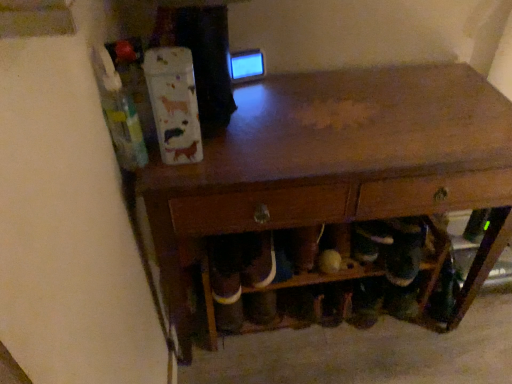
Question: From a real-world perspective, is wooden table at center over wooden shoe rack at lower center?

Choices:
 (A) yes
 (B) no

Answer: (A)

Question: From the image's perspective, would you say wooden table at center is shown under wooden shoe rack at lower center?

Choices:
 (A) yes
 (B) no

Answer: (B)

Question: Is wooden table at center taller than wooden shoe rack at lower center?

Choices:
 (A) yes
 (B) no

Answer: (A)

Question: Is wooden table at center turned away from wooden shoe rack at lower center?

Choices:
 (A) no
 (B) yes

Answer: (B)

Question: Does wooden table at center have a smaller size compared to wooden shoe rack at lower center?

Choices:
 (A) yes
 (B) no

Answer: (B)

Question: Can you confirm if wooden table at center is thinner than wooden shoe rack at lower center?

Choices:
 (A) yes
 (B) no

Answer: (B)

Question: Is wooden shoe rack at lower center taller than wooden table at center?

Choices:
 (A) yes
 (B) no

Answer: (B)

Question: Is the surface of wooden shoe rack at lower center in direct contact with wooden table at center?

Choices:
 (A) yes
 (B) no

Answer: (B)

Question: Can you confirm if wooden shoe rack at lower center is thinner than wooden table at center?

Choices:
 (A) no
 (B) yes

Answer: (B)

Question: Does wooden shoe rack at lower center have a smaller size compared to wooden table at center?

Choices:
 (A) no
 (B) yes

Answer: (B)

Question: Can you confirm if wooden shoe rack at lower center is positioned to the left of wooden table at center?

Choices:
 (A) no
 (B) yes

Answer: (B)

Question: From the image's perspective, is wooden shoe rack at lower center on wooden table at center?

Choices:
 (A) yes
 (B) no

Answer: (B)

Question: From a real-world perspective, is wooden table at center above or below wooden shoe rack at lower center?

Choices:
 (A) below
 (B) above

Answer: (B)